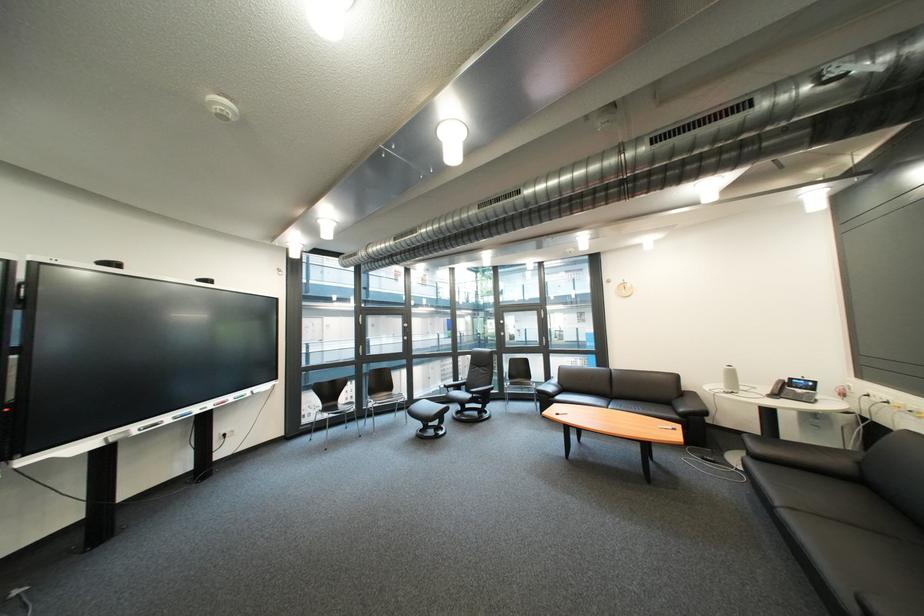
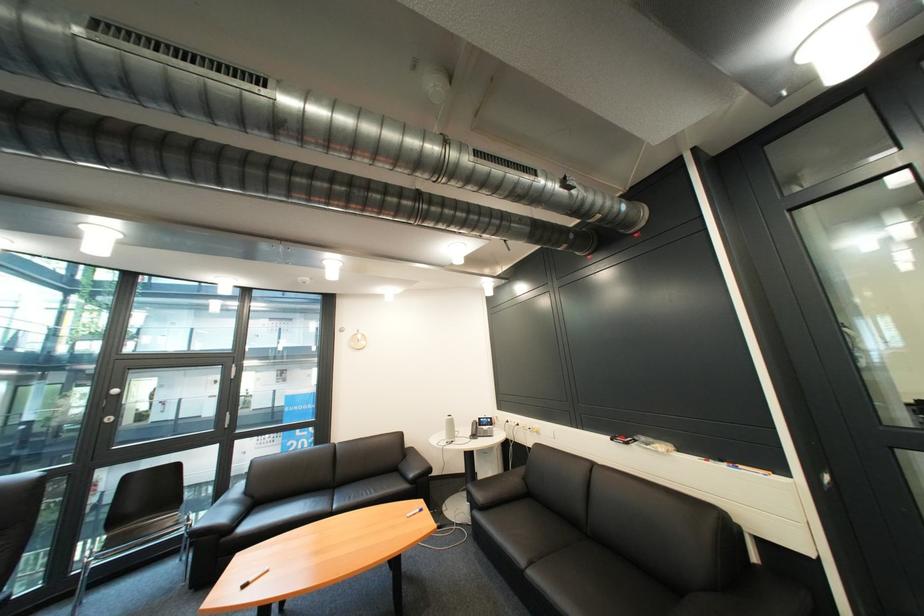
Where in the second image is the point corresponding to point (805, 379) from the first image?

(492, 419)